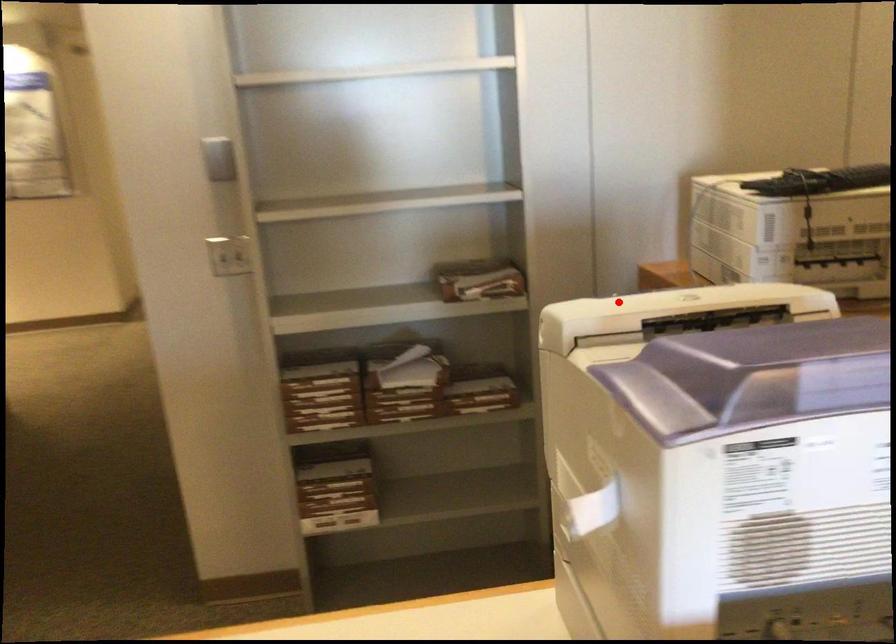
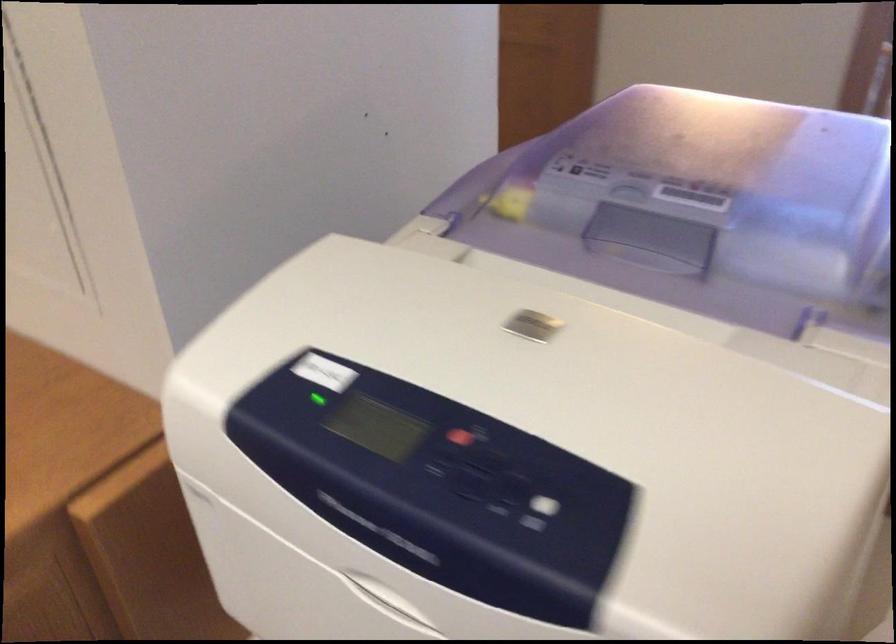
Question: I am providing you with two images of the same scene from different viewpoints. In image1, a red point is highlighted. Considering the same 3D point in image2, which of the following is correct?

Choices:
 (A) It is closer
 (B) It is farther

Answer: (A)